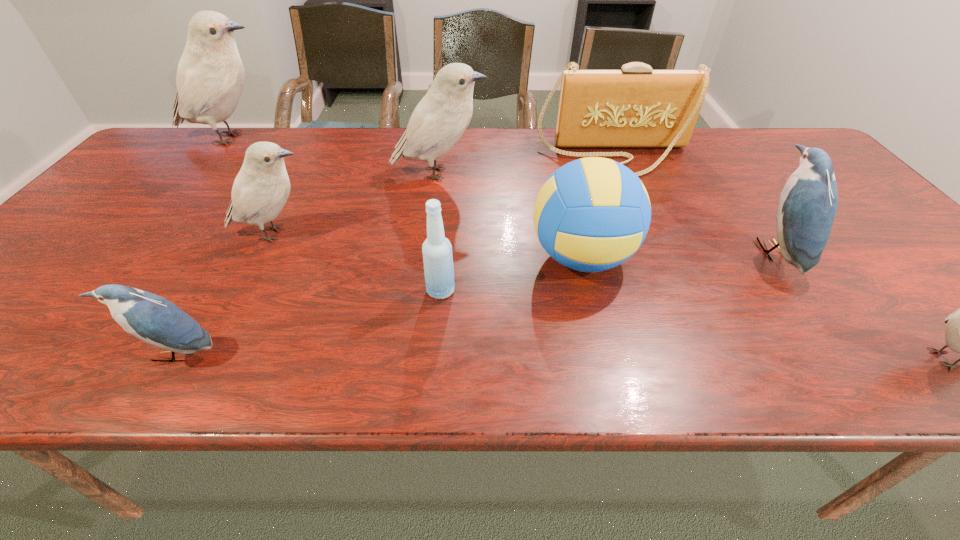
The image size is (960, 540). I want to click on the biggest white bird, so click(x=210, y=78).

I want to click on the farthest bird, so click(210, 78).

Locate an element on the screen. The height and width of the screenshot is (540, 960). the third white bird from left to right is located at coordinates (439, 120).

This screenshot has width=960, height=540. Identify the location of the second farthest bird. (439, 120).

At what (x,y) coordinates should I click in order to perform the action: click on handbag. Please return your answer as a coordinate pair (x, y). The height and width of the screenshot is (540, 960). Looking at the image, I should click on (636, 106).

You are a GUI agent. You are given a task and a screenshot of the screen. Output one action in this format:
    pyautogui.click(x=<x>, y=<y>)
    Task: Click on the second white bird from left to right
    
    Given the screenshot: What is the action you would take?
    pyautogui.click(x=260, y=190)

Locate an element on the screen. the second nearest white bird is located at coordinates (260, 190).

Identify the location of the second bird from right to left. This screenshot has height=540, width=960. (807, 206).

Locate an element on the screen. Image resolution: width=960 pixels, height=540 pixels. the farther blue bird is located at coordinates (807, 206).

Identify the location of volleyball. Image resolution: width=960 pixels, height=540 pixels. (592, 214).